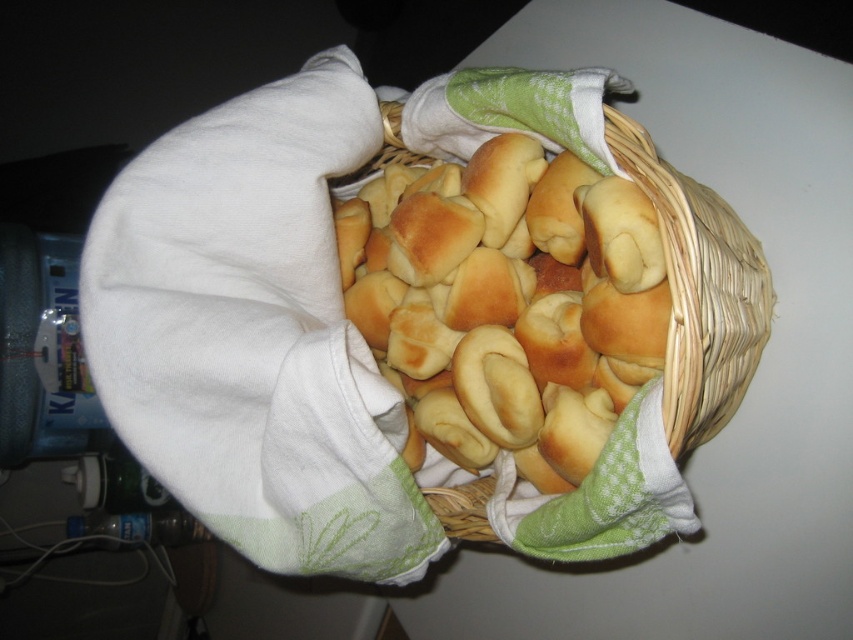
You are arranging items on a table and have both the white cotton cloth at upper left and the woven straw basket at center. If you want to place them side by side, which item should be placed first to ensure they fit on the table?

The white cotton cloth at upper left has a lesser width compared to the woven straw basket at center, so you should place the woven straw basket at center first to accommodate its larger width before placing the white cotton cloth at upper left.

You are arranging items on a table and need to place the white cotton cloth at upper left and the woven straw basket at center. If you want to ensure the basket is visible, which item should you place on top of the other?

The white cotton cloth at upper left is much taller than the woven straw basket at center. To ensure the basket is visible, you should place the white cotton cloth at upper left on top of the woven straw basket at center so that the taller cloth doesn